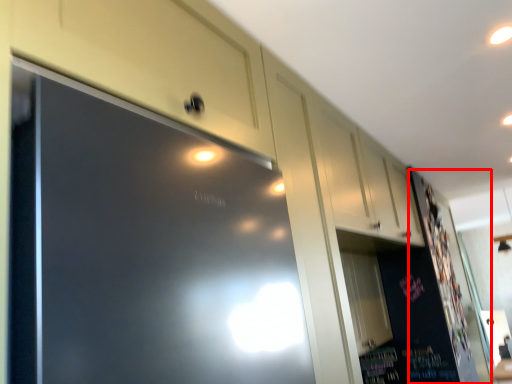
Question: From the image, what is the correct spatial relationship of bulletin board (annotated by the red box) in relation to cabinetry?

Choices:
 (A) left
 (B) right

Answer: (B)